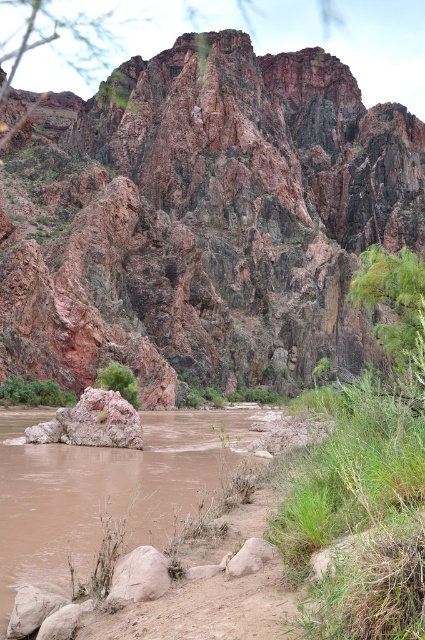
Measure the distance between point [285,112] and camera.

The distance of point [285,112] from camera is 225.55 meters.

Does rusty rock formation at center appear on the left side of smooth beige rock at lower center?

Yes, rusty rock formation at center is to the left of smooth beige rock at lower center.

Which is in front, point (419, 138) or point (127, 586)?

Positioned in front is point (127, 586).

The height and width of the screenshot is (640, 425). What are the coordinates of `rusty rock formation at center` in the screenshot? It's located at (201, 220).

Who is positioned more to the left, green grass at right or green leafy bush at center?

From the viewer's perspective, green leafy bush at center appears more on the left side.

Who is shorter, green grass at right or green leafy bush at center?

green leafy bush at center is shorter.

The image size is (425, 640). Find the location of `green grass at right`. green grass at right is located at coordinates (368, 474).

Locate an element on the screen. This screenshot has height=640, width=425. green grass at right is located at coordinates (368, 474).

Which is behind, point (300, 481) or point (136, 554)?

Point (300, 481)

Can you confirm if green grass at right is positioned to the left of smooth beige rock at lower center?

In fact, green grass at right is to the right of smooth beige rock at lower center.

Where is `green grass at right`? This screenshot has width=425, height=640. green grass at right is located at coordinates (368, 474).